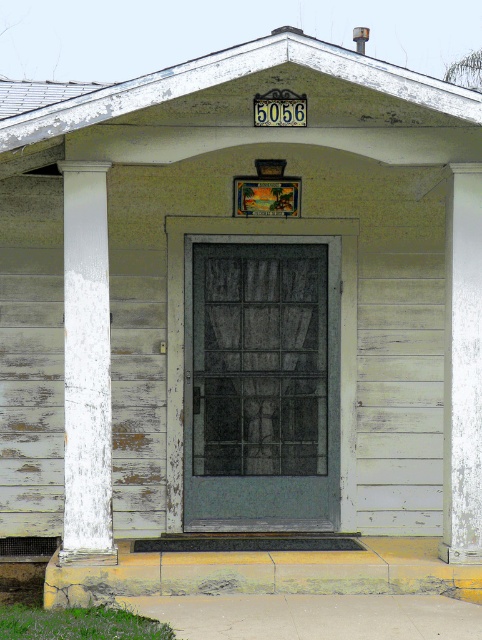
Question: Which object is farther from the camera taking this photo?

Choices:
 (A) white painted wood column at left
 (B) white painted wood at center

Answer: (B)

Question: Can you confirm if white painted wood column at left is positioned below white painted wood at center?

Choices:
 (A) no
 (B) yes

Answer: (A)

Question: Is white painted wood column at left above white painted wood at center?

Choices:
 (A) no
 (B) yes

Answer: (B)

Question: Does white painted wood column at left appear under white painted wood at center?

Choices:
 (A) yes
 (B) no

Answer: (B)